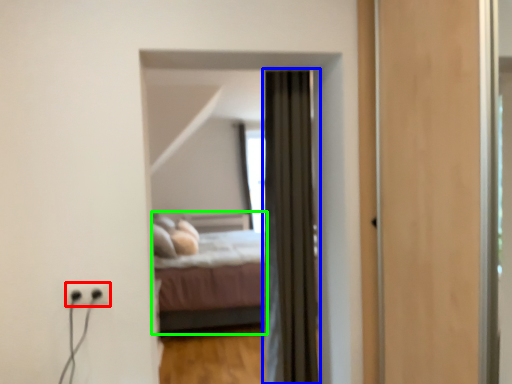
Question: Based on their relative distances, which object is farther from electric outlet (highlighted by a red box)? Choose from curtain (highlighted by a blue box) and bed (highlighted by a green box).

Choices:
 (A) curtain
 (B) bed

Answer: (B)